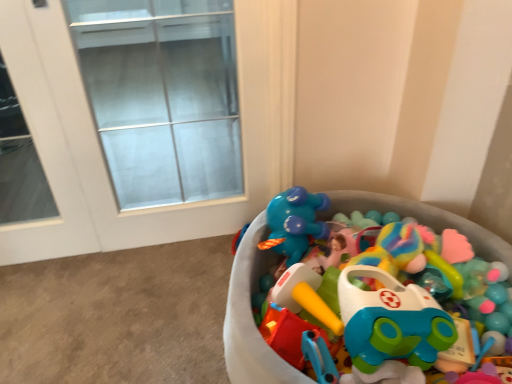
Question: Does transparent glass door at upper left have a greater width compared to plastic toy car at center?

Choices:
 (A) no
 (B) yes

Answer: (A)

Question: Is transparent glass door at upper left looking in the opposite direction of plastic toy car at center?

Choices:
 (A) no
 (B) yes

Answer: (A)

Question: Does transparent glass door at upper left have a lesser height compared to plastic toy car at center?

Choices:
 (A) yes
 (B) no

Answer: (B)

Question: Is transparent glass door at upper left further to camera compared to plastic toy car at center?

Choices:
 (A) no
 (B) yes

Answer: (B)

Question: Are transparent glass door at upper left and plastic toy car at center beside each other?

Choices:
 (A) no
 (B) yes

Answer: (A)

Question: Considering the relative positions of transparent glass door at upper left and plastic toy car at center in the image provided, is transparent glass door at upper left to the right of plastic toy car at center from the viewer's perspective?

Choices:
 (A) yes
 (B) no

Answer: (B)

Question: From the image's perspective, is plastic toy car at center located above transparent glass door at upper left?

Choices:
 (A) yes
 (B) no

Answer: (B)

Question: Does plastic toy car at center turn towards transparent glass door at upper left?

Choices:
 (A) yes
 (B) no

Answer: (B)

Question: From the image's perspective, is plastic toy car at center beneath transparent glass door at upper left?

Choices:
 (A) no
 (B) yes

Answer: (B)

Question: Is plastic toy car at center to the right of transparent glass door at upper left from the viewer's perspective?

Choices:
 (A) yes
 (B) no

Answer: (A)

Question: From a real-world perspective, is plastic toy car at center positioned under transparent glass door at upper left based on gravity?

Choices:
 (A) yes
 (B) no

Answer: (A)

Question: Is plastic toy car at center at the left side of transparent glass door at upper left?

Choices:
 (A) no
 (B) yes

Answer: (A)

Question: Is transparent glass door at upper left bigger or smaller than plastic toy car at center?

Choices:
 (A) small
 (B) big

Answer: (A)